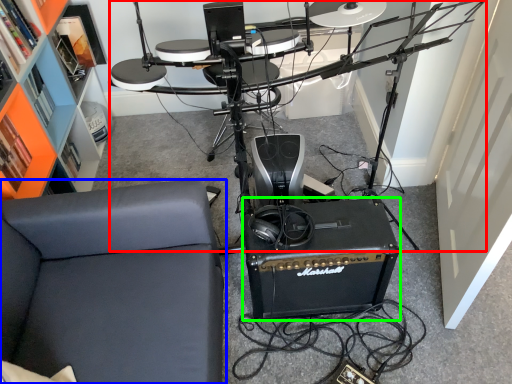
Question: Based on their relative distances, which object is nearer to computer desk (highlighted by a red box)? Choose from furniture (highlighted by a blue box) and speaker (highlighted by a green box).

Choices:
 (A) furniture
 (B) speaker

Answer: (B)